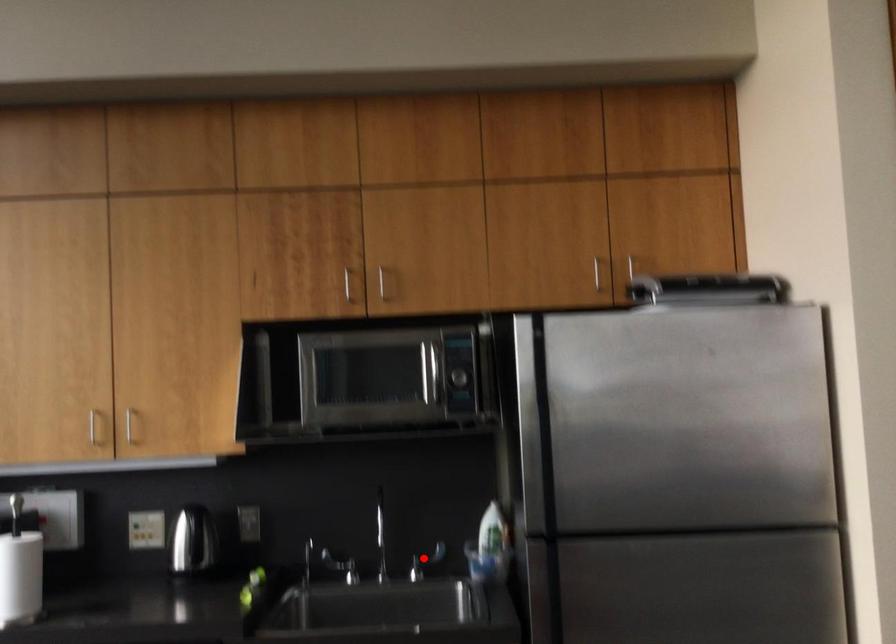
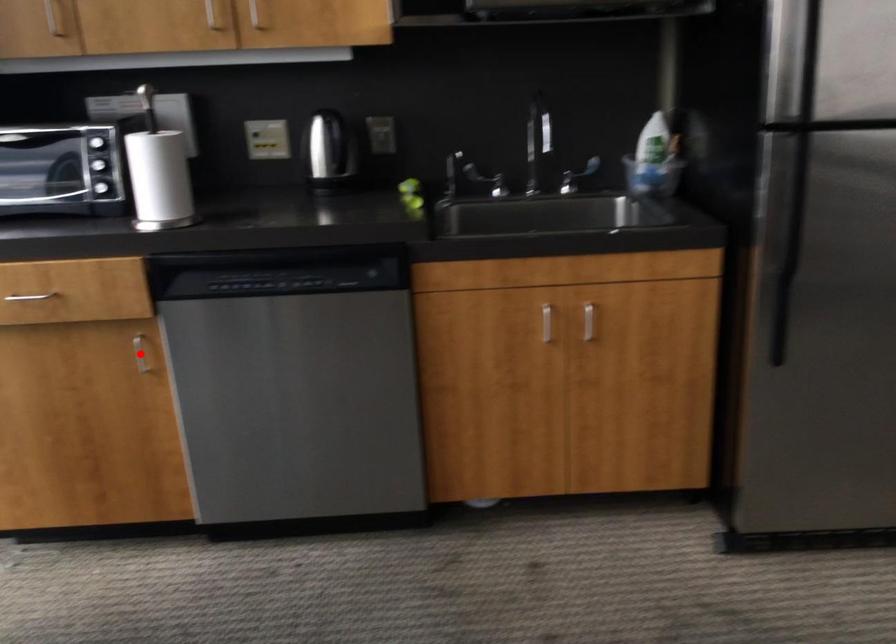
I am providing you with two images of the same scene from different viewpoints. A red point is marked on the first image and another point is marked on the second image. Is the red point in image1 aligned with the point shown in image2?

No